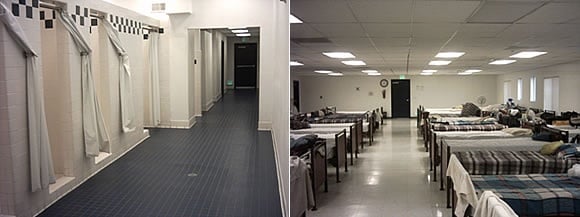
Find the location of a particular element. The height and width of the screenshot is (217, 580). curtain is located at coordinates (43, 102).